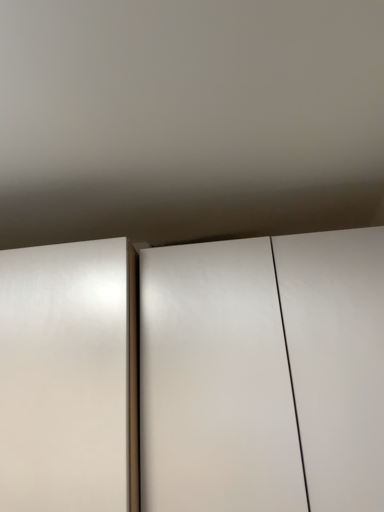
Question: Considering their positions, is satin white door at left located in front of or behind white glossy cupboard at center?

Choices:
 (A) front
 (B) behind

Answer: (A)

Question: Based on their positions, is satin white door at left located to the left or right of white glossy cupboard at center?

Choices:
 (A) right
 (B) left

Answer: (B)

Question: Considering the positions of satin white door at left and white glossy cupboard at center in the image, is satin white door at left taller or shorter than white glossy cupboard at center?

Choices:
 (A) tall
 (B) short

Answer: (B)

Question: Is point (314, 314) closer or farther from the camera than point (41, 472)?

Choices:
 (A) closer
 (B) farther

Answer: (B)

Question: In terms of size, does white glossy cupboard at center appear bigger or smaller than satin white door at left?

Choices:
 (A) small
 (B) big

Answer: (B)

Question: Considering their positions, is white glossy cupboard at center located in front of or behind satin white door at left?

Choices:
 (A) behind
 (B) front

Answer: (A)

Question: Would you say white glossy cupboard at center is to the left or to the right of satin white door at left in the picture?

Choices:
 (A) left
 (B) right

Answer: (B)